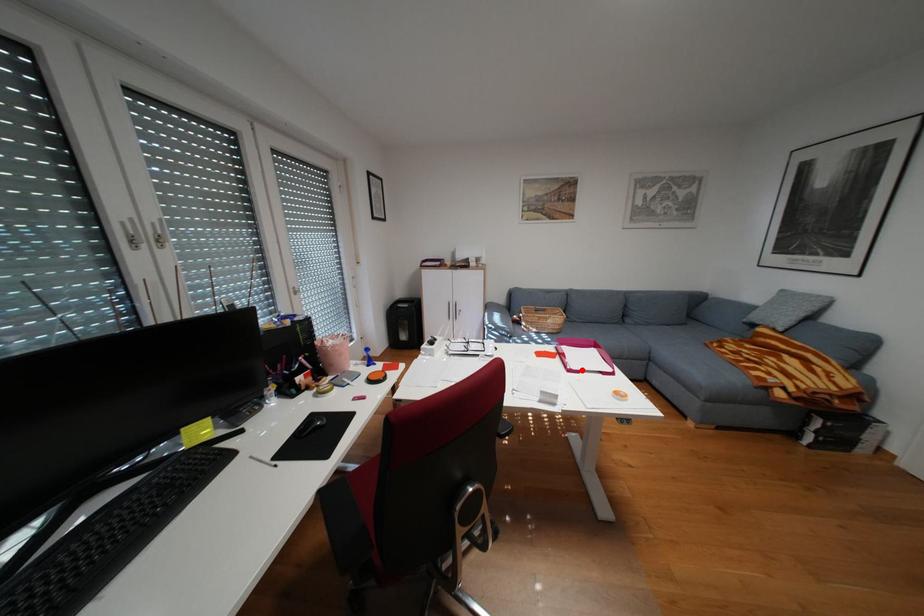
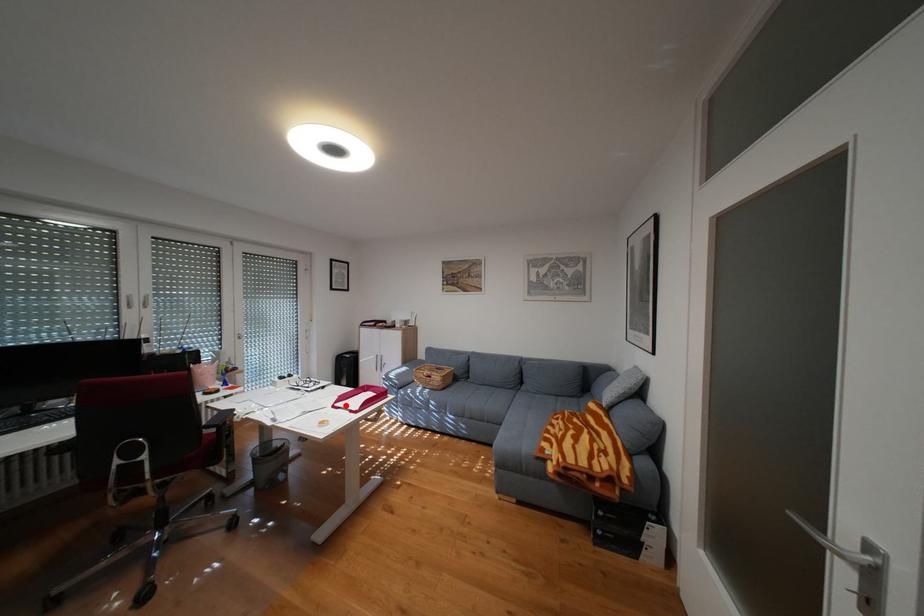
I am providing you with two images of the same scene from different viewpoints. A red point is marked on the first image and another point is marked on the second image. Is the marked point in image1 the same physical position as the marked point in image2?

Yes